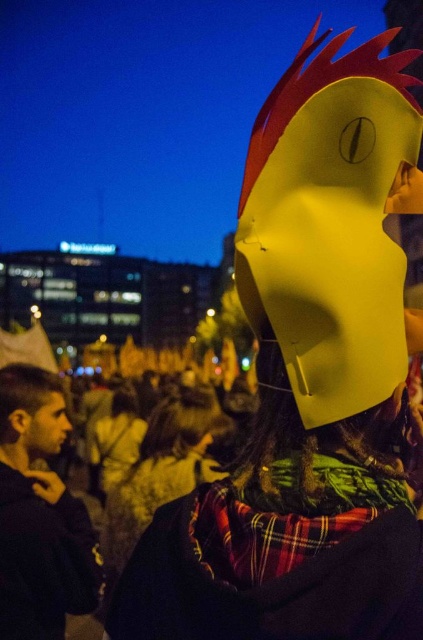
Who is higher up, yellow paper mask at upper right or matte yellow mask at upper center?

yellow paper mask at upper right

Measure the distance between yellow paper mask at upper right and matte yellow mask at upper center.

yellow paper mask at upper right and matte yellow mask at upper center are 91.80 feet apart.

Is point (242, 273) positioned before point (147, 426)?

Yes, it is.

This screenshot has width=423, height=640. In order to click on yellow paper mask at upper right in this screenshot , I will do `click(332, 224)`.

Between matte yellow mask at upper center and matte black hair at lower left, which one has more height?

Standing taller between the two is matte yellow mask at upper center.

Can you confirm if matte yellow mask at upper center is positioned above matte black hair at lower left?

No, matte yellow mask at upper center is not above matte black hair at lower left.

Which is behind, point (120, 515) or point (49, 388)?

Point (120, 515)

The width and height of the screenshot is (423, 640). I want to click on matte yellow mask at upper center, so click(x=162, y=467).

Is point (316, 147) farther from viewer compared to point (52, 390)?

No, it is in front of (52, 390).

Can you confirm if yellow paper mask at upper right is smaller than smooth skin face at lower left?

Incorrect, yellow paper mask at upper right is not smaller in size than smooth skin face at lower left.

Who is more distant from viewer, (422, 131) or (63, 436)?

Point (63, 436)

Identify the location of yellow paper mask at upper right. The image size is (423, 640). (332, 224).